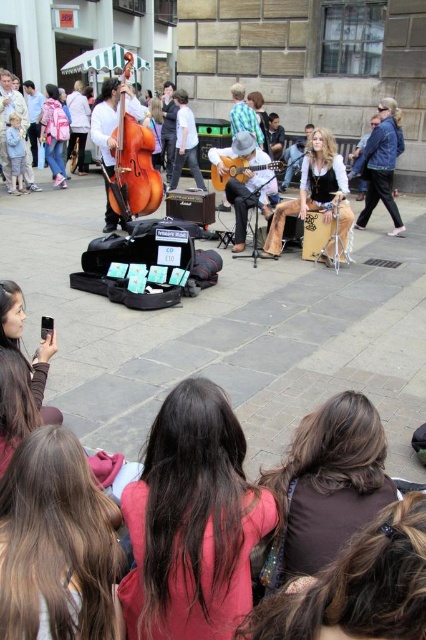
You are a photographer trying to capture the performance. You notice the leather pants at center and the blue leather jacket at right. Which object is positioned to the left of the other?

The leather pants at center are positioned to the left of the blue leather jacket at right.